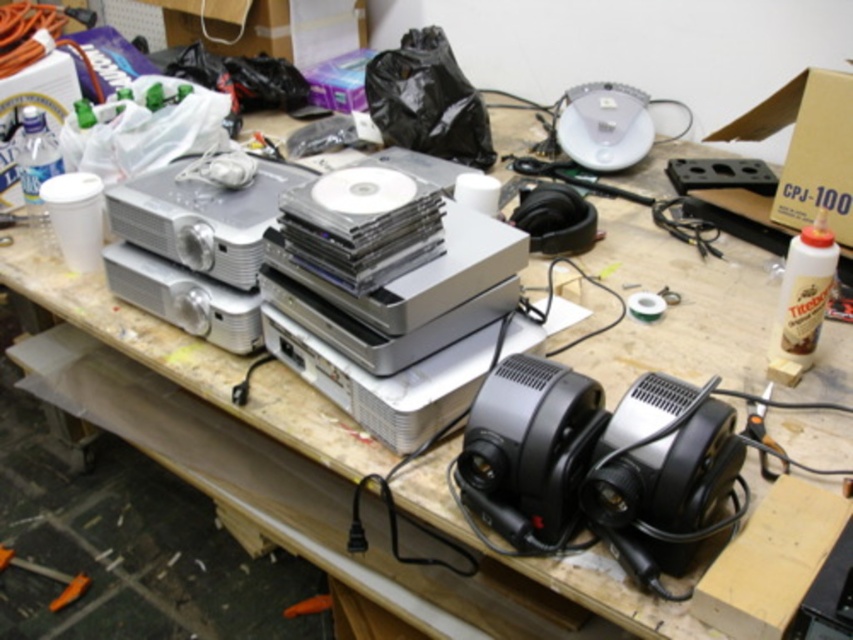
Question: Considering the real-world distances, which object is closest to the black plastic speaker at lower right?

Choices:
 (A) black plastic speaker at center
 (B) silver metallic projector at center

Answer: (A)

Question: Is the position of black plastic speaker at lower right less distant than that of silver metallic projector at center?

Choices:
 (A) yes
 (B) no

Answer: (A)

Question: Is black plastic speaker at lower right bigger than black plastic speaker at center?

Choices:
 (A) yes
 (B) no

Answer: (A)

Question: Estimate the real-world distances between objects in this image. Which object is farther from the silver metallic projector at center?

Choices:
 (A) black plastic speaker at lower right
 (B) black plastic speaker at center

Answer: (A)

Question: Does black plastic speaker at center appear on the left side of silver metallic projector at center?

Choices:
 (A) no
 (B) yes

Answer: (A)

Question: Which object is closer to the camera taking this photo?

Choices:
 (A) silver metallic projector at center
 (B) black plastic speaker at lower right

Answer: (B)